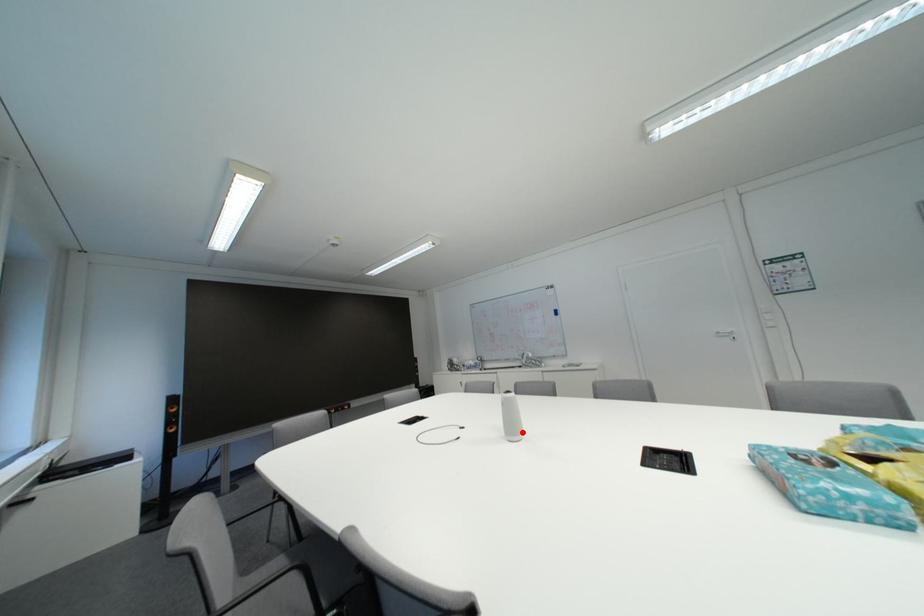
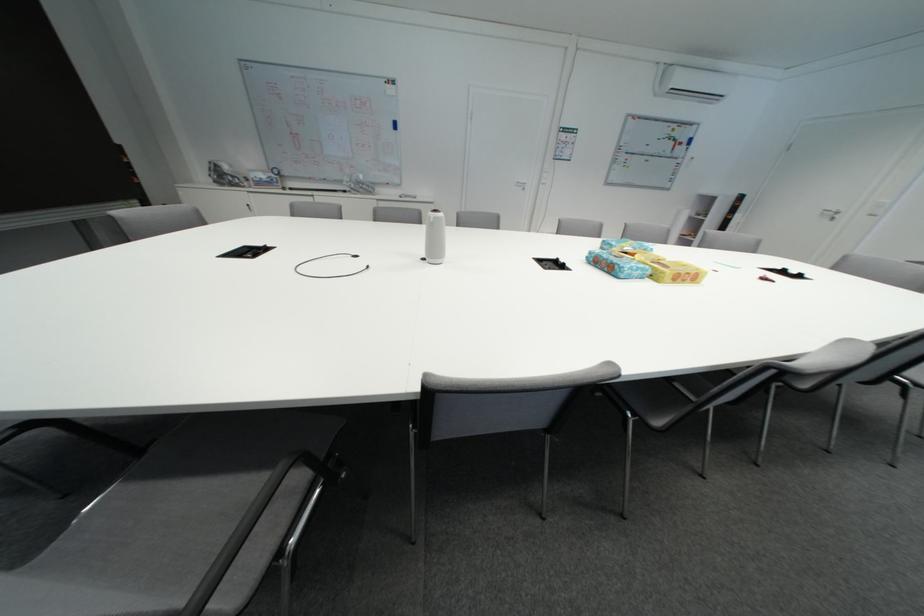
Find the pixel in the second image that matches the highlighted location in the first image.

(444, 254)